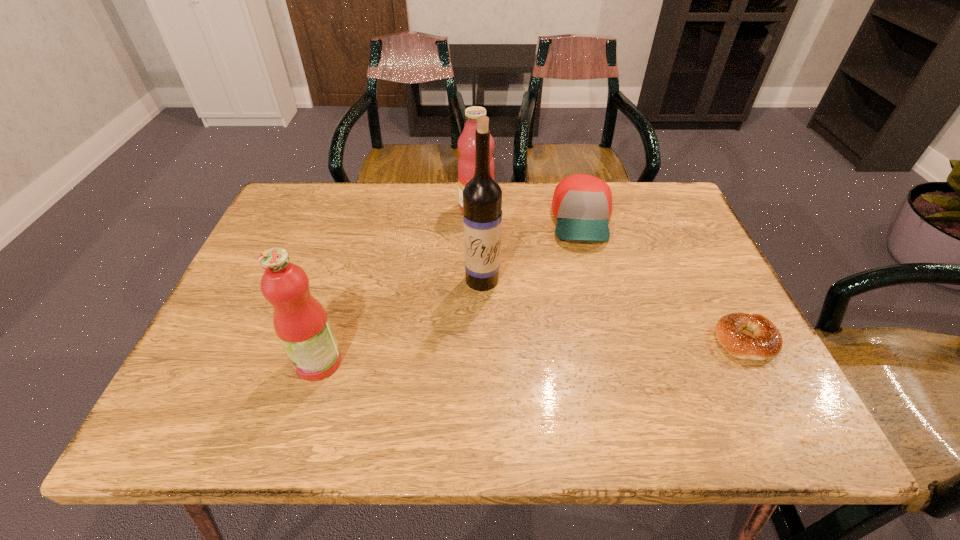
In the image, there is a desktop. At what (x,y) coordinates should I click in order to perform the action: click on free space at the left edge. Please return your answer as a coordinate pair (x, y). The width and height of the screenshot is (960, 540). Looking at the image, I should click on (235, 340).

Where is `free location at the right edge`? free location at the right edge is located at coordinates (731, 309).

In the image, there is a desktop. Where is `vacant space at the far left corner`? This screenshot has width=960, height=540. vacant space at the far left corner is located at coordinates (307, 203).

Locate an element on the screen. The height and width of the screenshot is (540, 960). vacant space at the far right corner of the desktop is located at coordinates (684, 214).

In the image, there is a desktop. Identify the location of vacant space at the near right corner. (727, 363).

Identify the location of empty space between the tallest object and the bagel. (614, 310).

Locate an element on the screen. The image size is (960, 540). free space that is in between the bagel and the wine bottle is located at coordinates (614, 310).

At what (x,y) coordinates should I click in order to perform the action: click on vacant area that lies between the nearer fruit juice and the tallest object. Please return your answer as a coordinate pair (x, y). The width and height of the screenshot is (960, 540). Looking at the image, I should click on (400, 321).

Where is `vacant space that's between the right fruit juice and the baseball cap`? vacant space that's between the right fruit juice and the baseball cap is located at coordinates (529, 214).

I want to click on free space that is in between the bagel and the left fruit juice, so click(532, 352).